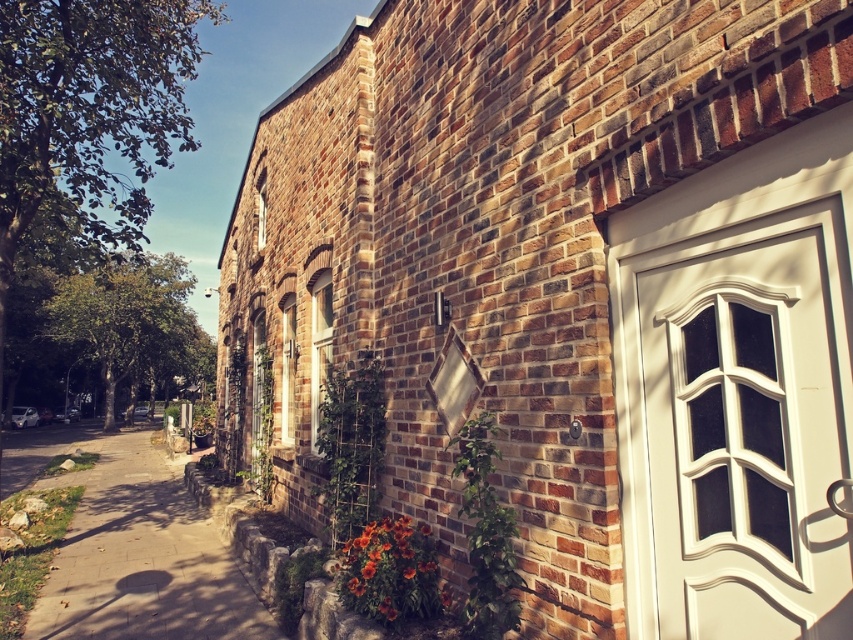
Question: Which point appears closest to the camera in this image?

Choices:
 (A) pos(252,589)
 (B) pos(399,522)

Answer: (B)

Question: Can you confirm if gray concrete sidewalk at lower left is wider than vibrant orange petals at lower center?

Choices:
 (A) yes
 (B) no

Answer: (A)

Question: Is gray concrete sidewalk at lower left above vibrant orange petals at lower center?

Choices:
 (A) no
 (B) yes

Answer: (A)

Question: Is gray concrete sidewalk at lower left closer to camera compared to vibrant orange petals at lower center?

Choices:
 (A) no
 (B) yes

Answer: (A)

Question: Which of the following is the closest to the observer?

Choices:
 (A) (119, 605)
 (B) (412, 536)

Answer: (B)